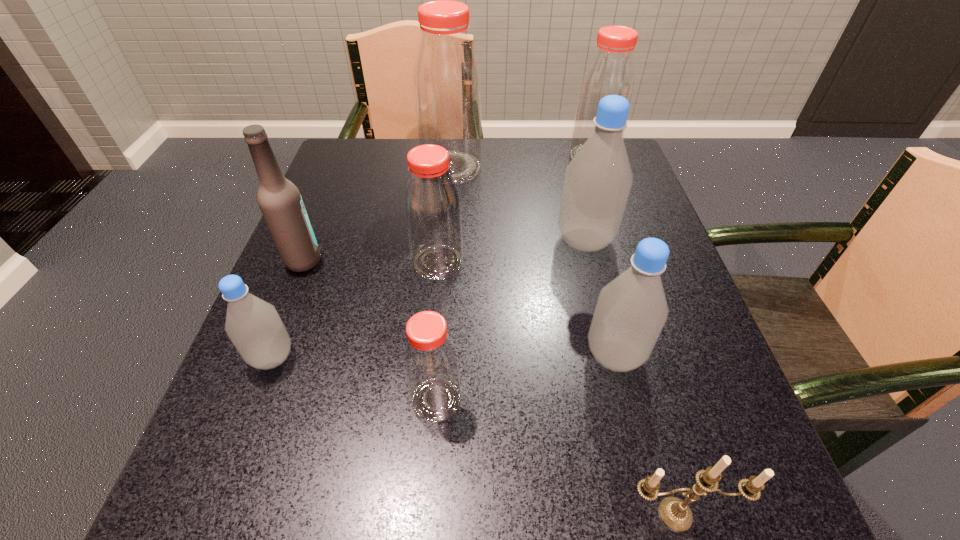
I want to click on candle, so click(x=675, y=513).

The width and height of the screenshot is (960, 540). I want to click on the nearest object, so click(x=675, y=513).

Image resolution: width=960 pixels, height=540 pixels. In order to click on vacant space located 0.270m on the front of the biggest red bottle in this screenshot , I will do `click(444, 265)`.

Where is `blank area located on the left of the rightmost red bottle`? blank area located on the left of the rightmost red bottle is located at coordinates (476, 157).

At what (x,y) coordinates should I click in order to perform the action: click on vacant area situated 0.360m on the left of the biggest gray bottle. Please return your answer as a coordinate pair (x, y). Looking at the image, I should click on (381, 240).

Identify the location of vacant space situated on the side of the beer bottle with the label. (362, 261).

The width and height of the screenshot is (960, 540). I want to click on vacant position located 0.070m on the back of the second nearest red bottle, so click(442, 224).

You are a GUI agent. You are given a task and a screenshot of the screen. Output one action in this format:
    pyautogui.click(x=<x>, y=<y>)
    Task: Click on the free spot located on the left of the second biggest gray bottle
    
    Given the screenshot: What is the action you would take?
    pyautogui.click(x=536, y=355)

I want to click on free space located 0.180m on the left of the smallest red bottle, so click(291, 400).

Locate an element on the screen. Image resolution: width=960 pixels, height=540 pixels. free point located on the right of the smallest gray bottle is located at coordinates (492, 357).